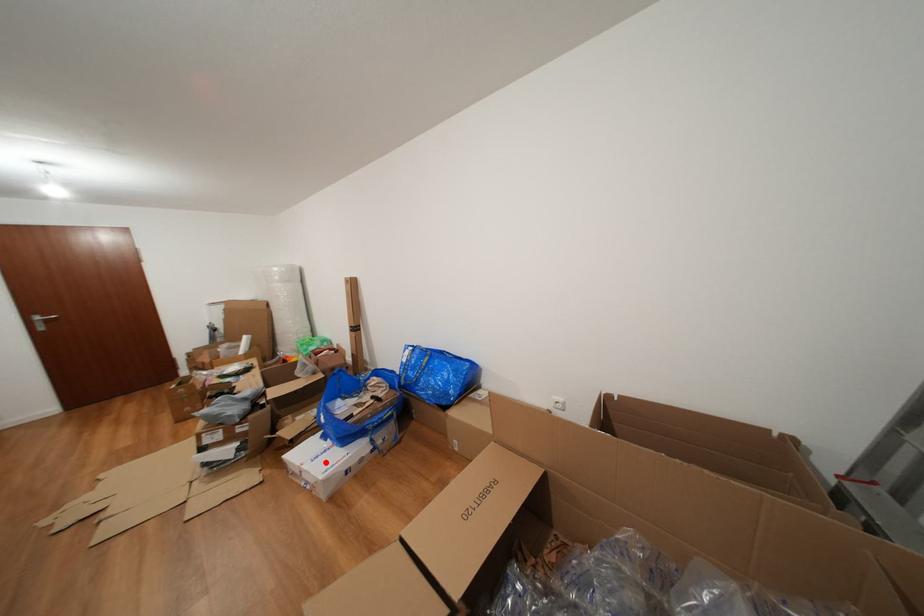
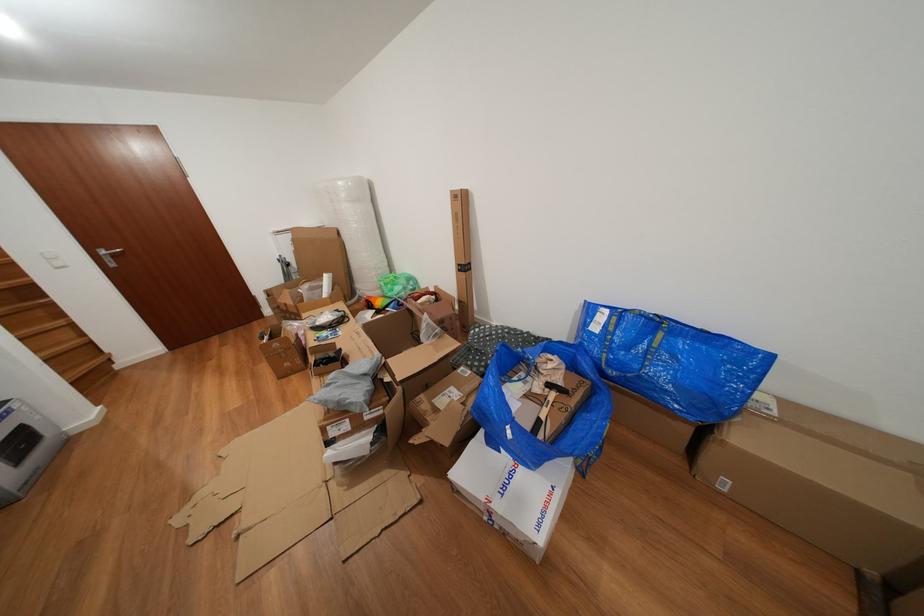
Question: I am providing you with two images of the same scene from different viewpoints. In image1, a red point is highlighted. Considering the same 3D point in image2, which of the following is correct?

Choices:
 (A) It is closer
 (B) It is farther

Answer: (A)